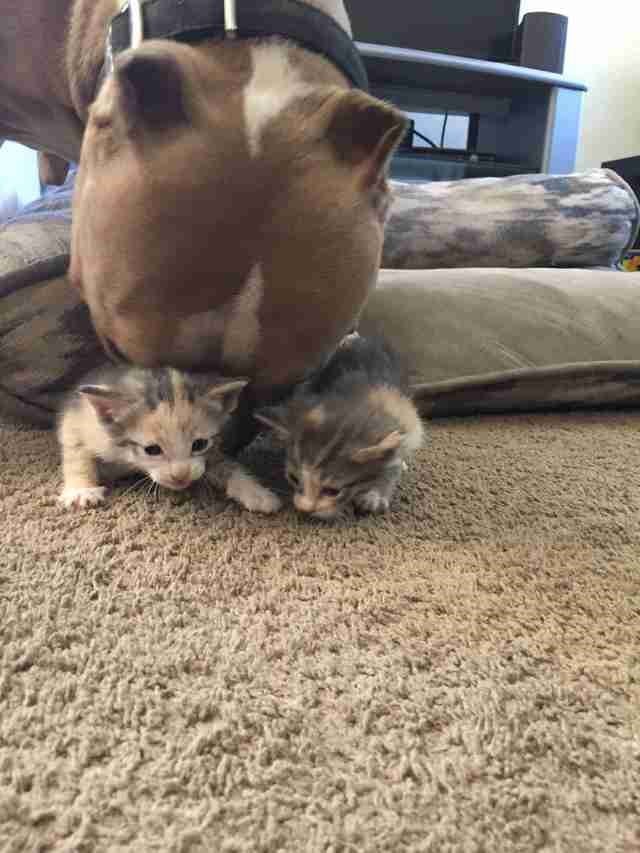
You are a GUI agent. You are given a task and a screenshot of the screen. Output one action in this format:
    pyautogui.click(x=<x>, y=<y>)
    Task: Click on the television
    The image size is (640, 853).
    Given the screenshot: What is the action you would take?
    pyautogui.click(x=452, y=13)